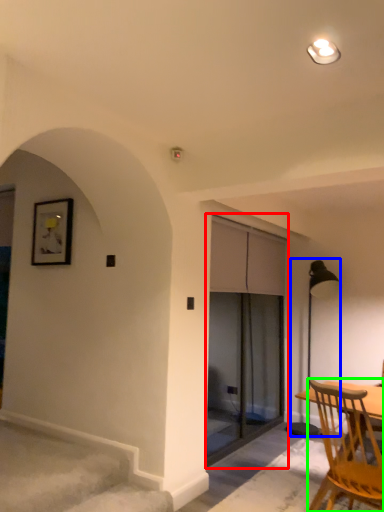
Question: Considering the real-world distances, which object is closest to screen door (highlighted by a red box)? lamp (highlighted by a blue box) or chair (highlighted by a green box).

Choices:
 (A) lamp
 (B) chair

Answer: (A)